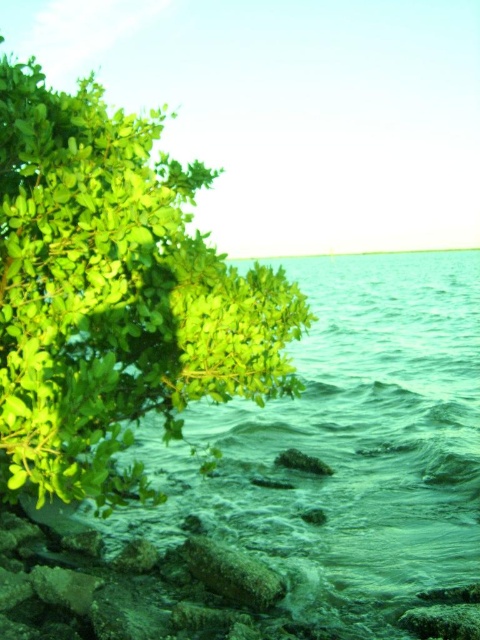
Question: Which of the following is the farthest from the observer?

Choices:
 (A) green translucent water at lower left
 (B) green leafy tree at left

Answer: (A)

Question: Which object is closer to the camera taking this photo?

Choices:
 (A) green translucent water at lower left
 (B) green leafy tree at left

Answer: (B)

Question: Does green leafy tree at left have a lesser width compared to green translucent water at lower left?

Choices:
 (A) yes
 (B) no

Answer: (A)

Question: Does green leafy tree at left appear under green translucent water at lower left?

Choices:
 (A) yes
 (B) no

Answer: (A)

Question: In this image, where is green leafy tree at left located relative to green translucent water at lower left?

Choices:
 (A) left
 (B) right

Answer: (A)